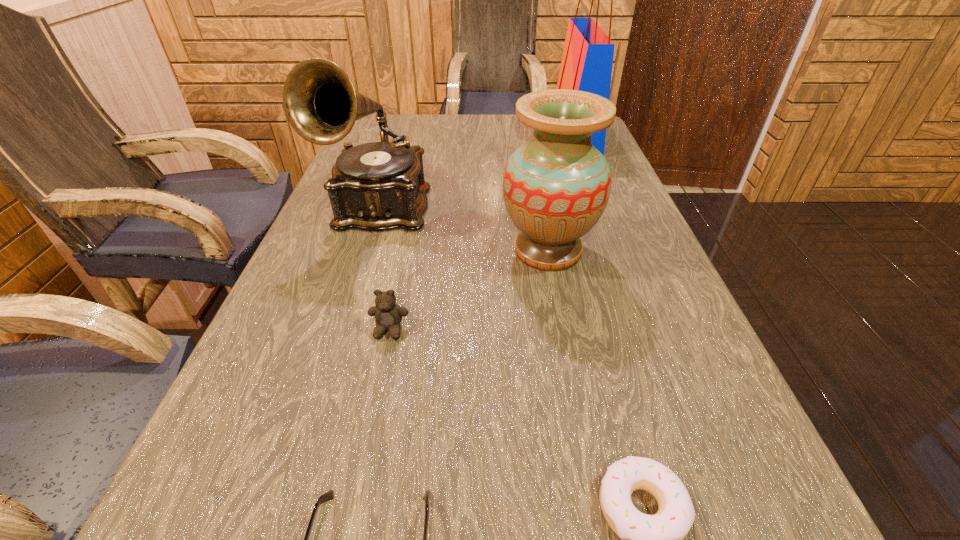
The image size is (960, 540). I want to click on vacant space located on the front of the vase, so click(x=565, y=341).

Locate an element on the screen. The width and height of the screenshot is (960, 540). vacant space located 0.130m on the face of the third shortest object is located at coordinates (372, 410).

The image size is (960, 540). Identify the location of object located in the far edge section of the desktop. coord(587,60).

This screenshot has width=960, height=540. What are the coordinates of `object at the left edge` in the screenshot? It's located at (374, 186).

Identify the location of shopping bag that is at the right edge. (587, 60).

I want to click on vase that is at the right edge, so click(556, 186).

In order to click on object located in the far right corner section of the desktop in this screenshot , I will do `click(587, 60)`.

The height and width of the screenshot is (540, 960). In the image, there is a desktop. Find the location of `blank space at the left edge`. blank space at the left edge is located at coordinates (195, 466).

Locate an element on the screen. This screenshot has width=960, height=540. vacant space at the right edge of the desktop is located at coordinates (626, 194).

This screenshot has width=960, height=540. I want to click on vacant space in between the third shortest object and the fourth shortest object, so pos(468,290).